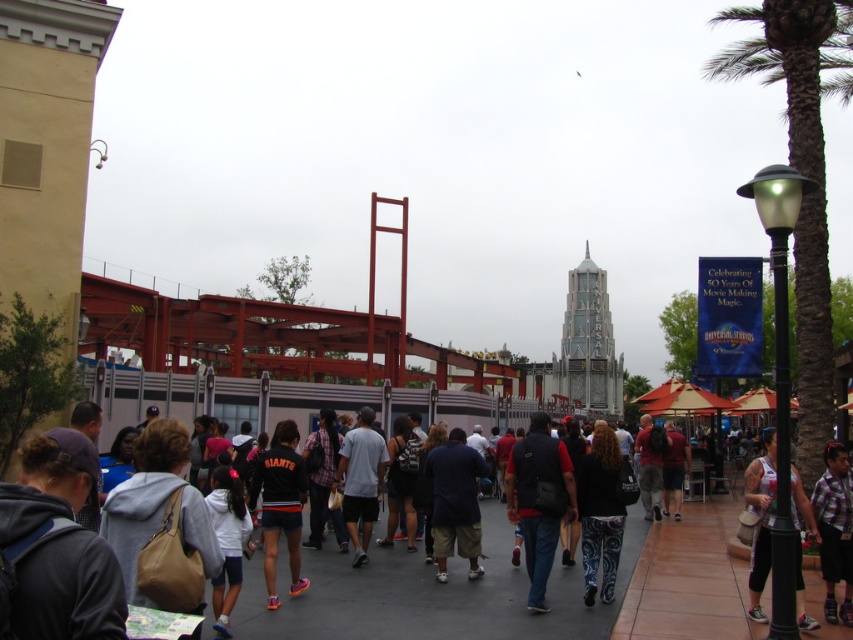
Question: Can you confirm if gray concrete pavement at center is wider than red painted steel bridge at center?

Choices:
 (A) yes
 (B) no

Answer: (B)

Question: Which point is closer to the camera?

Choices:
 (A) (560, 358)
 (B) (614, 464)
 (C) (363, 358)

Answer: (B)

Question: Which of the following is the farthest from the observer?

Choices:
 (A) (846, 624)
 (B) (180, 307)
 (C) (366, 481)
 (D) (465, 467)

Answer: (B)

Question: Can you confirm if shiny silver tower at center is positioned to the left of gray matte shirt at center?

Choices:
 (A) yes
 (B) no

Answer: (B)

Question: Which object is farther from the camera taking this photo?

Choices:
 (A) dark blue fabric pants at center
 (B) reddish-brown backpack at center-right
 (C) green textured palm tree at right

Answer: (B)

Question: Does dark gray hoodie at lower left have a larger size compared to light gray hoodie at center?

Choices:
 (A) no
 (B) yes

Answer: (A)